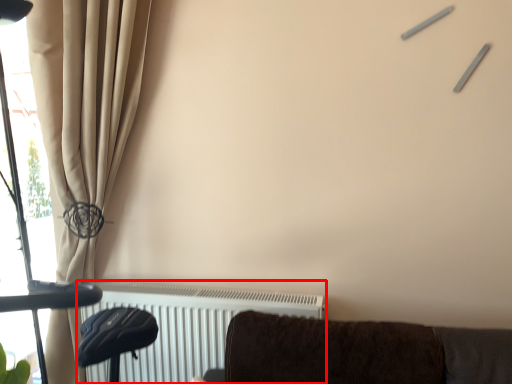
Question: Observing the image, what is the correct spatial positioning of radiator (annotated by the red box) in reference to curtain?

Choices:
 (A) right
 (B) left

Answer: (A)